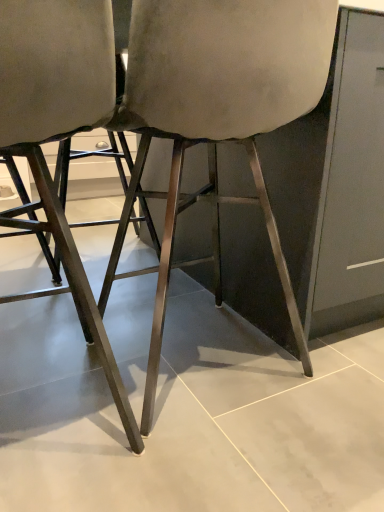
Question: Is matte gray fabric chair at center, which is the 1th chair from left to right, positioned beyond the bounds of satin silver chair at center, the 1th chair when ordered from right to left?

Choices:
 (A) no
 (B) yes

Answer: (B)

Question: Is matte gray fabric chair at center, acting as the 2th chair starting from the right, thinner than satin silver chair at center, the 1th chair when ordered from right to left?

Choices:
 (A) no
 (B) yes

Answer: (B)

Question: Is satin silver chair at center, which is the 2th chair from left to right, at the back of matte gray fabric chair at center, which is the 1th chair from left to right?

Choices:
 (A) no
 (B) yes

Answer: (A)

Question: Is matte gray fabric chair at center, acting as the 2th chair starting from the right, aimed at satin silver chair at center, which is the 2th chair from left to right?

Choices:
 (A) yes
 (B) no

Answer: (B)

Question: Can satin silver chair at center, the 1th chair when ordered from right to left, be found inside matte gray fabric chair at center, acting as the 2th chair starting from the right?

Choices:
 (A) no
 (B) yes

Answer: (A)

Question: From a real-world perspective, is matte gray fabric chair at center, which is the 1th chair from left to right, located higher than satin silver chair at center, the 1th chair when ordered from right to left?

Choices:
 (A) no
 (B) yes

Answer: (A)

Question: Considering the relative positions of satin silver chair at center, which is the 2th chair from left to right, and matte gray fabric chair at center, acting as the 2th chair starting from the right, in the image provided, is satin silver chair at center, which is the 2th chair from left to right, to the left of matte gray fabric chair at center, acting as the 2th chair starting from the right, from the viewer's perspective?

Choices:
 (A) yes
 (B) no

Answer: (B)

Question: Does satin silver chair at center, the 1th chair when ordered from right to left, lie behind matte gray fabric chair at center, acting as the 2th chair starting from the right?

Choices:
 (A) no
 (B) yes

Answer: (B)

Question: Is satin silver chair at center, which is the 2th chair from left to right, positioned with its back to matte gray fabric chair at center, acting as the 2th chair starting from the right?

Choices:
 (A) yes
 (B) no

Answer: (B)

Question: From a real-world perspective, does satin silver chair at center, the 1th chair when ordered from right to left, sit lower than matte gray fabric chair at center, acting as the 2th chair starting from the right?

Choices:
 (A) yes
 (B) no

Answer: (B)

Question: Considering the relative sizes of satin silver chair at center, the 1th chair when ordered from right to left, and matte gray fabric chair at center, which is the 1th chair from left to right, in the image provided, is satin silver chair at center, the 1th chair when ordered from right to left, bigger than matte gray fabric chair at center, which is the 1th chair from left to right,?

Choices:
 (A) no
 (B) yes

Answer: (B)

Question: Is the depth of satin silver chair at center, which is the 2th chair from left to right, less than that of matte gray fabric chair at center, acting as the 2th chair starting from the right?

Choices:
 (A) no
 (B) yes

Answer: (A)

Question: Considering their positions, is satin silver chair at center, which is the 2th chair from left to right, located in front of or behind matte gray fabric chair at center, acting as the 2th chair starting from the right?

Choices:
 (A) behind
 (B) front

Answer: (A)